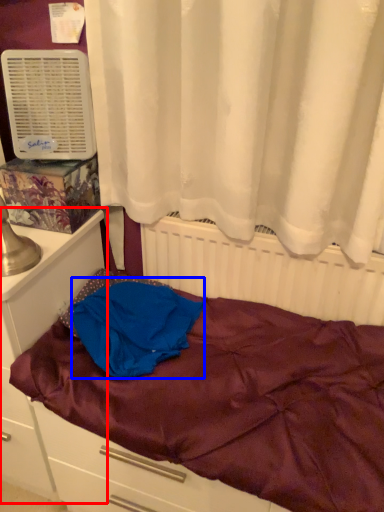
Question: Which object is further to the camera taking this photo, file cabinet (highlighted by a red box) or blanket (highlighted by a blue box)?

Choices:
 (A) file cabinet
 (B) blanket

Answer: (B)